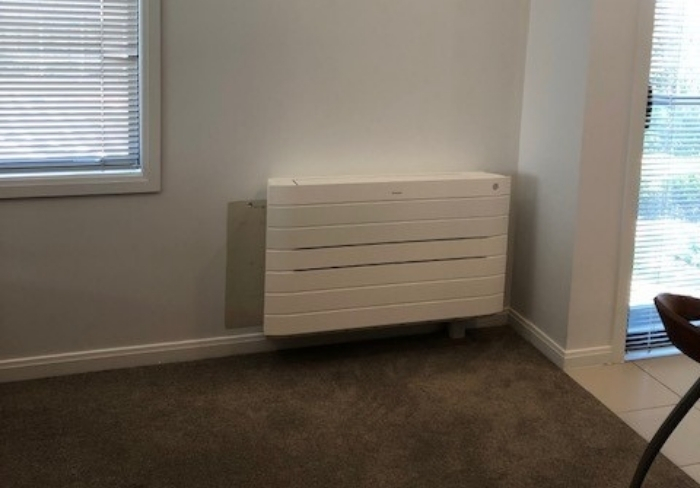
Where is `marks on carpet from hand or furniture`? The width and height of the screenshot is (700, 488). marks on carpet from hand or furniture is located at coordinates (377, 406).